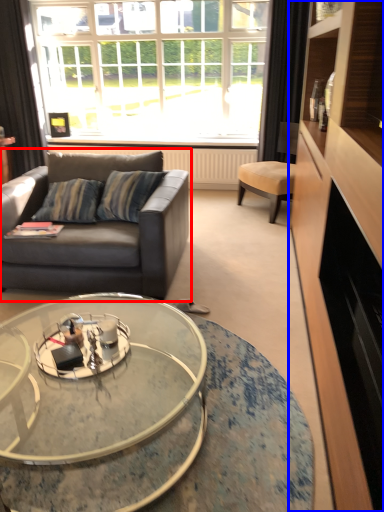
Question: Which of the following is the closest to the observer, studio couch (highlighted by a red box) or cabinetry (highlighted by a blue box)?

Choices:
 (A) studio couch
 (B) cabinetry

Answer: (B)